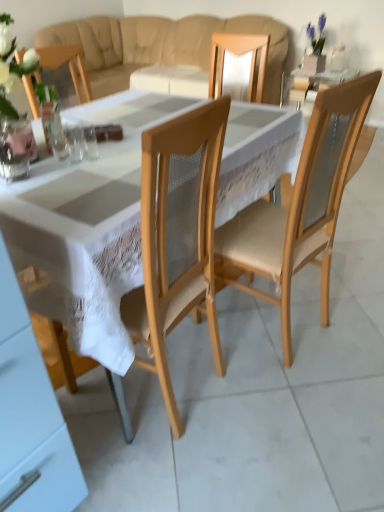
Identify the location of vacant area to the right of clear glass vase at lower left. This screenshot has width=384, height=512. (71, 175).